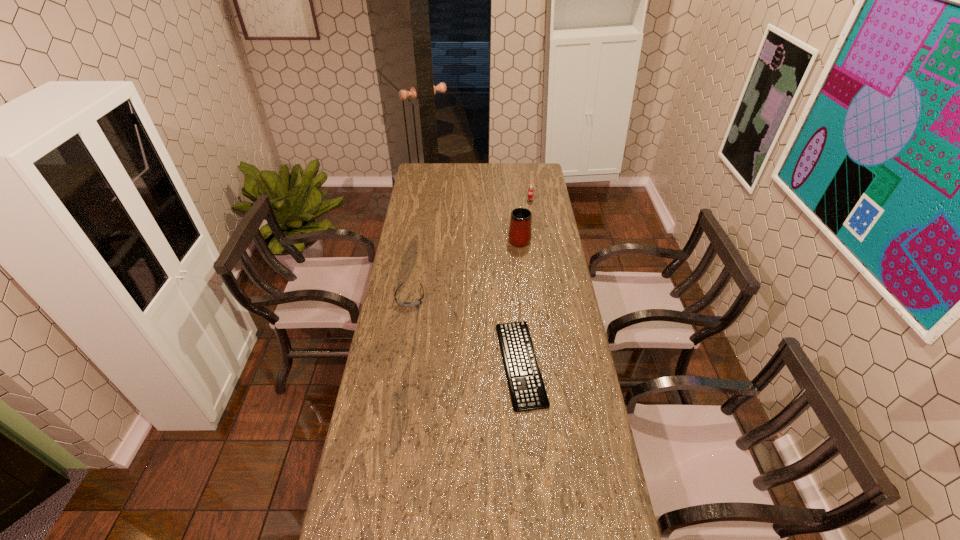
The height and width of the screenshot is (540, 960). What are the coordinates of `free space at the right edge of the desktop` in the screenshot? It's located at (566, 417).

I want to click on vacant area at the far left corner of the desktop, so click(414, 178).

The width and height of the screenshot is (960, 540). Identify the location of vacant space that's between the farthest object and the second shortest object. (470, 250).

At what (x,y) coordinates should I click in order to perform the action: click on free spot between the sunglasses and the rightmost object. Please return your answer as a coordinate pair (x, y). Looking at the image, I should click on (470, 250).

Find the location of a particular element. free spot between the third shortest object and the computer keyboard is located at coordinates (525, 283).

Where is `free space between the shortest object and the third nearest object`? This screenshot has width=960, height=540. free space between the shortest object and the third nearest object is located at coordinates (520, 301).

Find the location of a particular element. free space between the rightmost object and the leftmost object is located at coordinates (470, 250).

Identify the location of vacant space that's between the third tallest object and the soda bottle. The height and width of the screenshot is (540, 960). (470, 250).

Locate an element on the screen. The width and height of the screenshot is (960, 540). blank region between the second nearest object and the third shortest object is located at coordinates (470, 250).

Where is `the second closest object to the leftmost object`? the second closest object to the leftmost object is located at coordinates (520, 234).